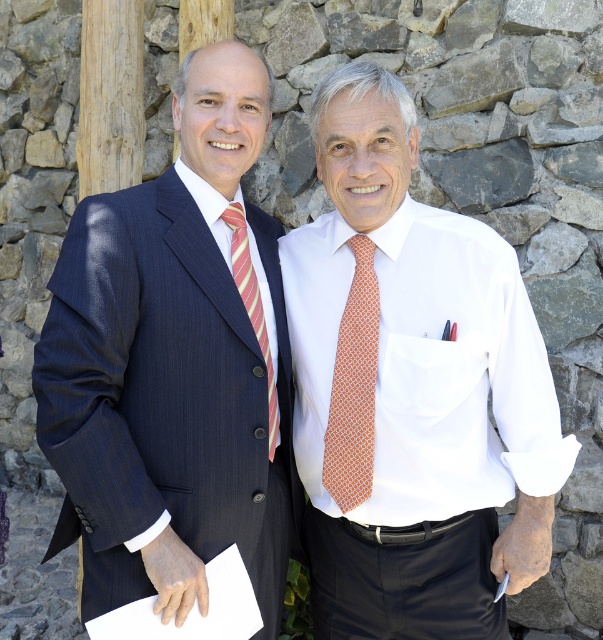
You are standing in a professional event and want to approach the point marked by coordinates point (382,362). If you take a step forward of 1 meter, will you be closer to the point than 1.25 meters?

The distance between you and point (382,362) is initially 2.25 meters. After moving forward 1 meter, the new distance becomes 1.25 meters. Therefore, you will be exactly at 1.25 meters from the point.

You are a photographer setting up for a professional photoshoot. You need to ensure that both the white smooth dress shirt at center and the orange dotted tie at center are clearly visible in the frame. Based on their positions, which one should you focus on first to ensure proper lighting?

The white smooth dress shirt at center is above the orange dotted tie at center, so focusing on the white smooth dress shirt at center first will ensure proper lighting since it is positioned higher in the frame.

You are a photographer at a professional event. You need to capture a closeup shot focusing on the white fabric pocket at center and the striped silk tie at center. Which object should you adjust your camera to focus on first if you want to start from the left side of the scene?

The striped silk tie at center should be focused on first because it is positioned to the left of the white fabric pocket at center.